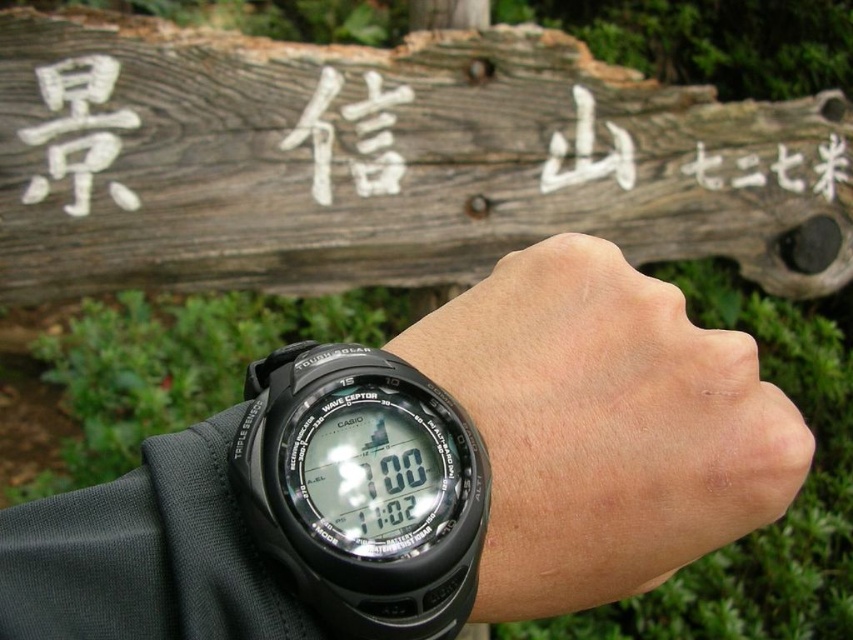
Is black plastic watch at center shorter than white wood sign at upper center?

Indeed, black plastic watch at center has a lesser height compared to white wood sign at upper center.

Is the position of black plastic watch at center more distant than that of white wood sign at upper center?

No.

Measure the distance between point [357,540] and camera.

Point [357,540] and camera are 30.02 centimeters apart.

This screenshot has width=853, height=640. I want to click on black plastic watch at center, so click(x=363, y=490).

Which is behind, point (759, 513) or point (398, 545)?

The point (759, 513) is behind.

Does black rubber watch at lower center have a lesser height compared to black plastic watch at center?

No, black rubber watch at lower center is not shorter than black plastic watch at center.

Who is more forward, (x=572, y=376) or (x=337, y=468)?

Point (x=337, y=468)

Where is `black rubber watch at lower center`? The width and height of the screenshot is (853, 640). black rubber watch at lower center is located at coordinates (604, 426).

Does weathered wood sign at upper center appear under black plastic watch at center?

Actually, weathered wood sign at upper center is above black plastic watch at center.

Does weathered wood sign at upper center have a smaller size compared to black plastic watch at center?

Actually, weathered wood sign at upper center might be larger than black plastic watch at center.

What do you see at coordinates (384, 161) in the screenshot? I see `weathered wood sign at upper center` at bounding box center [384, 161].

Where is `weathered wood sign at upper center`? weathered wood sign at upper center is located at coordinates click(x=384, y=161).